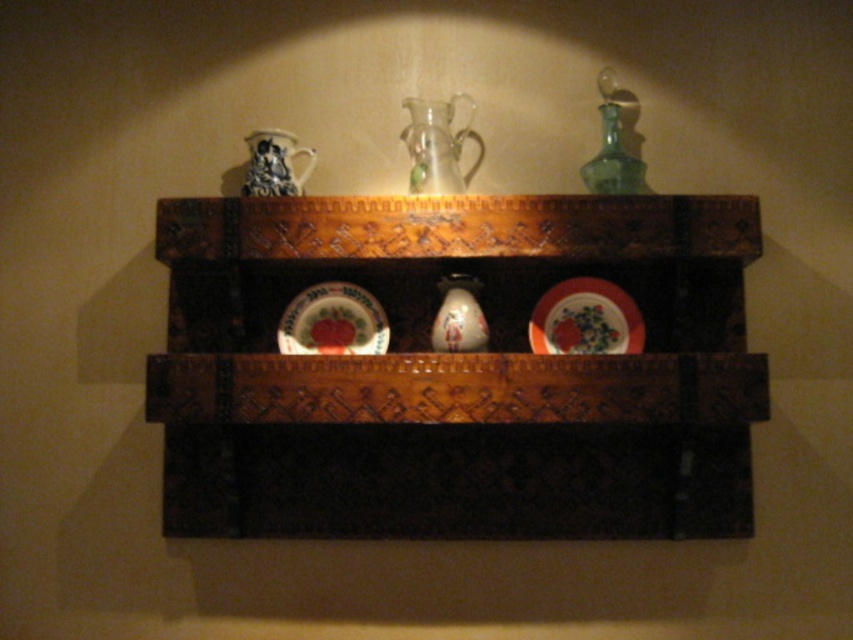
Question: Based on their relative distances, which object is farther from the porcelain vase at center?

Choices:
 (A) blue and white porcelain jug at upper left
 (B) transparent glass pitcher at center
 (C) porcelain plate at center

Answer: (A)

Question: Does porcelain plate at center appear on the right side of green glass bottle at upper right?

Choices:
 (A) no
 (B) yes

Answer: (A)

Question: Which object is the closest to the wooden carved shelf at center?

Choices:
 (A) porcelain vase at center
 (B) porcelain plate at center

Answer: (B)

Question: Based on their relative distances, which object is nearer to the green glass bottle at upper right?

Choices:
 (A) wooden carved shelf at center
 (B) transparent glass pitcher at center
 (C) porcelain vase at center

Answer: (B)

Question: Can you confirm if green glass bottle at upper right is positioned to the right of porcelain vase at center?

Choices:
 (A) yes
 (B) no

Answer: (A)

Question: Does porcelain plate with floral design at center appear over green glass bottle at upper right?

Choices:
 (A) yes
 (B) no

Answer: (B)